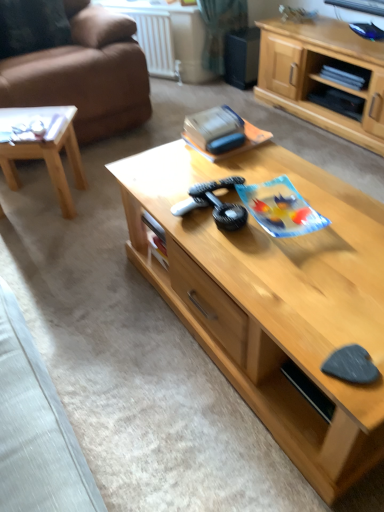
The image size is (384, 512). I want to click on vacant space in between light wood coffee table at center, which is counted as the second coffee table, starting from the left, and light brown wood coffee table at left, positioned as the 1th coffee table in left-to-right order, so click(x=120, y=286).